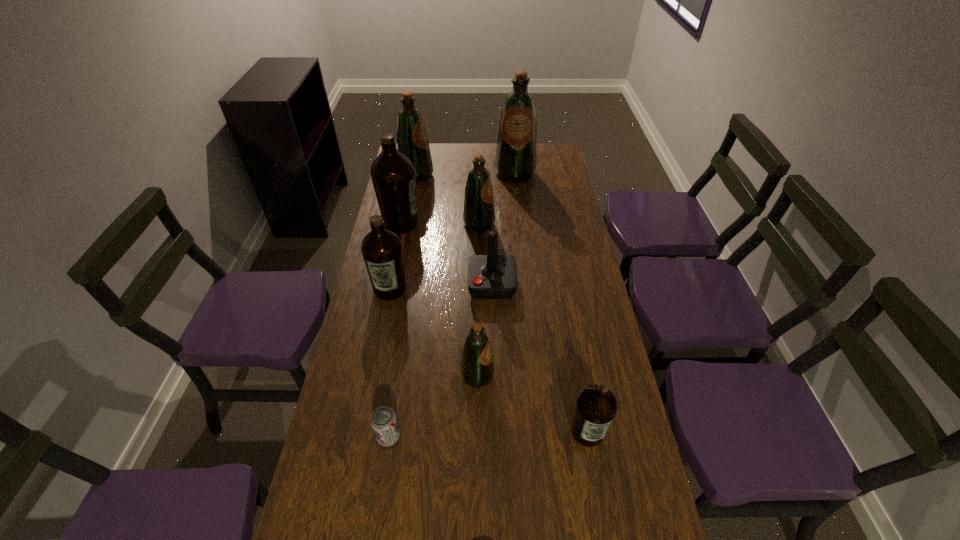
At what (x,y) coordinates should I click in order to perform the action: click on the biggest green olive oil. Please return your answer as a coordinate pair (x, y). Image resolution: width=960 pixels, height=540 pixels. Looking at the image, I should click on tap(515, 161).

Locate an element on the screen. This screenshot has width=960, height=540. the rightmost green olive oil is located at coordinates (515, 161).

Find the location of a particular element. The image size is (960, 540). the leftmost green olive oil is located at coordinates (412, 140).

Where is `the farthest brown olive oil`? This screenshot has height=540, width=960. the farthest brown olive oil is located at coordinates (x=393, y=175).

Identify the location of the second smallest green olive oil. (479, 215).

Locate an element on the screen. This screenshot has height=540, width=960. the second smallest brown olive oil is located at coordinates (382, 251).

Where is `the second nearest brown olive oil`? Image resolution: width=960 pixels, height=540 pixels. the second nearest brown olive oil is located at coordinates (382, 251).

Image resolution: width=960 pixels, height=540 pixels. In order to click on joystick in this screenshot , I will do `click(492, 276)`.

Find the location of a particular element. the second nearest olive oil is located at coordinates (477, 369).

Find the location of `the smallest green olive oil`. the smallest green olive oil is located at coordinates (477, 369).